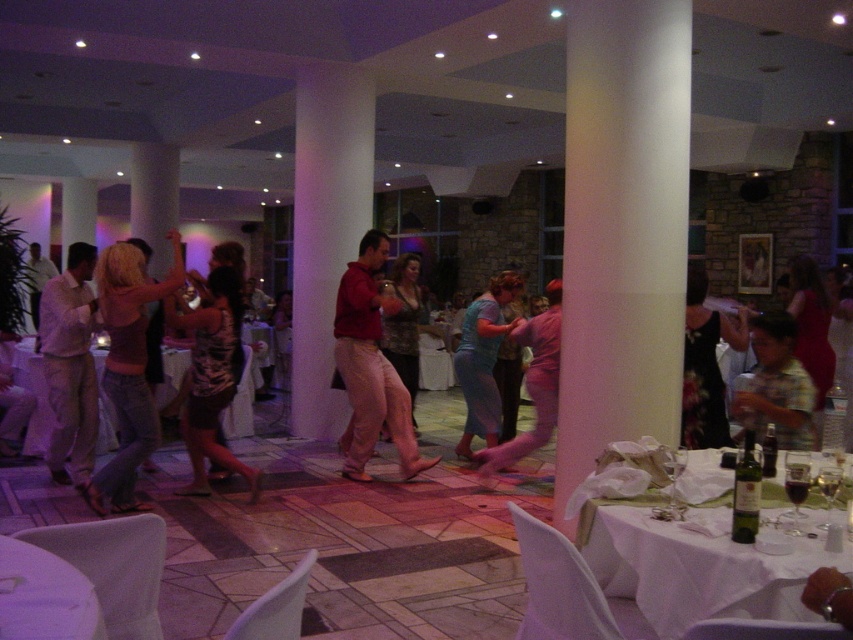
Is white cloth table at lower right positioned at the back of plaid shirt at lower right?

That is False.

Is white cloth table at lower right to the right of plaid shirt at lower right from the viewer's perspective?

Incorrect, white cloth table at lower right is not on the right side of plaid shirt at lower right.

The width and height of the screenshot is (853, 640). Find the location of `white cloth table at lower right`. white cloth table at lower right is located at coordinates (695, 566).

Find the location of a particular element. Image resolution: width=853 pixels, height=640 pixels. white cloth table at lower right is located at coordinates (695, 566).

Does point (360, 317) come closer to viewer compared to point (54, 452)?

No, (360, 317) is further to viewer.

Between point (389, 378) and point (73, 371), which one is positioned in front?

Point (73, 371)

Locate an element on the screen. This screenshot has width=853, height=640. matte red shirt at center is located at coordinates (370, 364).

Who is more distant from viewer, [711,435] or [675,480]?

The point [711,435] is behind.

Which is in front, point (701, 420) or point (679, 452)?

Point (679, 452)

Where is `black satin dress at center`? black satin dress at center is located at coordinates (705, 365).